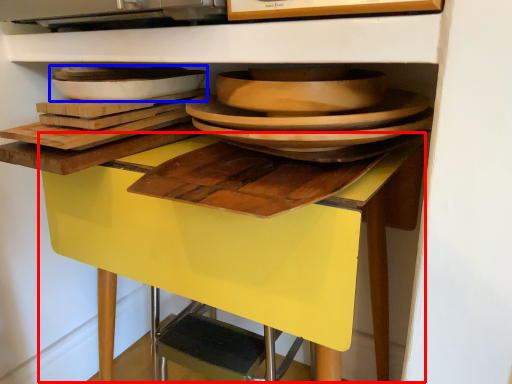
Question: Which of the following is the closest to the observer, table (highlighted by a red box) or platter (highlighted by a blue box)?

Choices:
 (A) table
 (B) platter

Answer: (A)